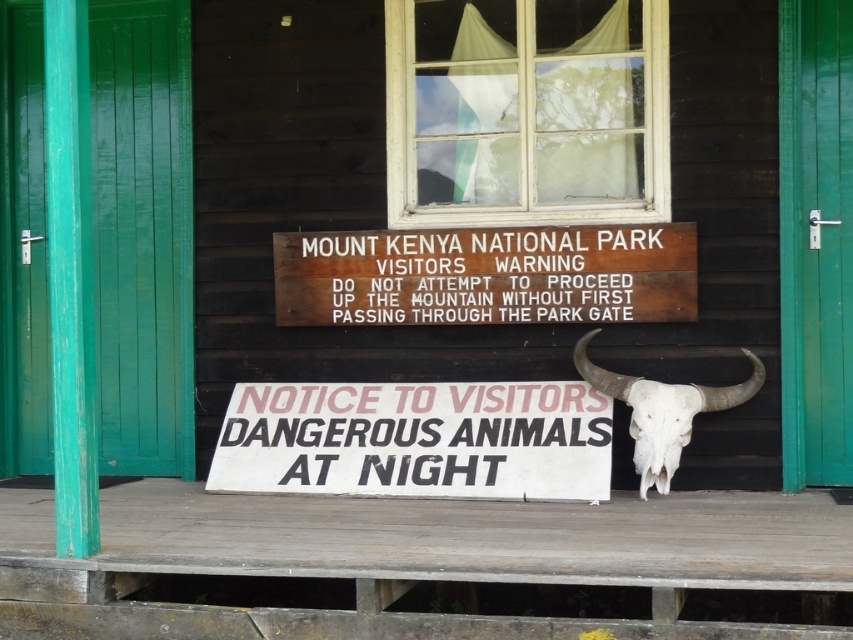
Question: Does white paper sign at lower center have a greater width compared to white bone skull at right?

Choices:
 (A) yes
 (B) no

Answer: (A)

Question: Estimate the real-world distances between objects in this image. Which object is farther from the brown wooden sign at upper center?

Choices:
 (A) white bone skull at center
 (B) white paper sign at lower center

Answer: (A)

Question: Can you confirm if white paper sign at lower center is positioned below white bone skull at center?

Choices:
 (A) no
 (B) yes

Answer: (B)

Question: Which object is closer to the camera taking this photo?

Choices:
 (A) white paper sign at lower center
 (B) brown wooden sign at upper center

Answer: (A)

Question: Does brown wooden sign at upper center lie in front of white bone skull at right?

Choices:
 (A) yes
 (B) no

Answer: (B)

Question: Which point is farther to the camera?

Choices:
 (A) (257, 422)
 (B) (688, 260)

Answer: (A)